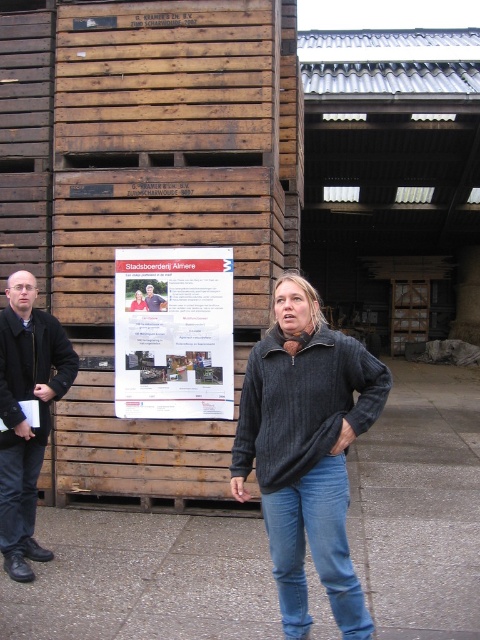
Question: Is black wool coat at left closer to the viewer compared to matte black shirt at center?

Choices:
 (A) yes
 (B) no

Answer: (A)

Question: Which is farther from the matte black shirt at center?

Choices:
 (A) black wool coat at left
 (B) white paper poster at center
 (C) blue denim jeans at lower left
 (D) blue denim jeans at center

Answer: (D)

Question: Is white paper poster at center to the left of black wool coat at left from the viewer's perspective?

Choices:
 (A) no
 (B) yes

Answer: (A)

Question: Estimate the real-world distances between objects in this image. Which object is closer to the blue denim jeans at center?

Choices:
 (A) white paper poster at center
 (B) matte black shirt at center
 (C) black wool coat at left
 (D) blue denim jeans at lower left

Answer: (C)

Question: Which of the following is the closest to the observer?

Choices:
 (A) black wool coat at left
 (B) blue denim jeans at lower left

Answer: (A)

Question: Does white paper poster at center have a larger size compared to blue denim jeans at center?

Choices:
 (A) yes
 (B) no

Answer: (A)